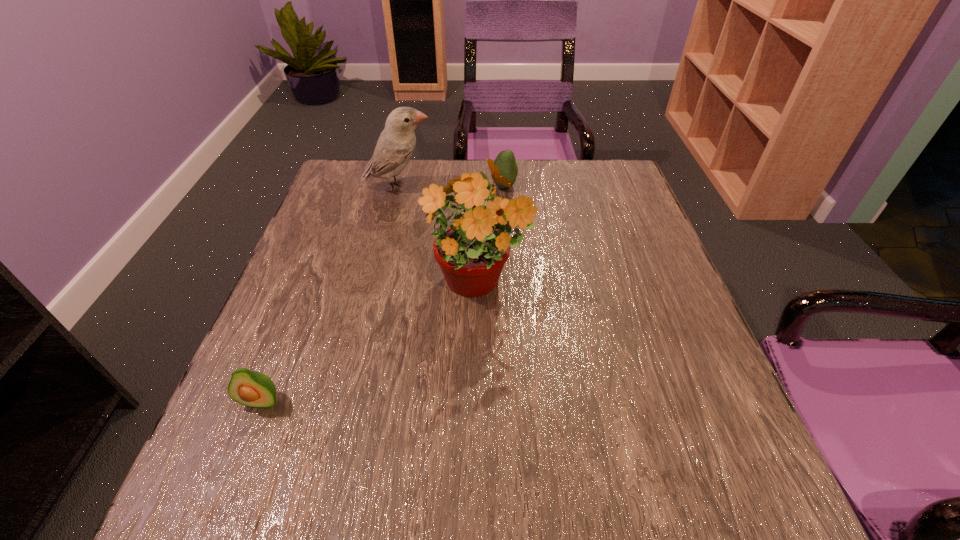
Where is `blank area at the far left corner`? blank area at the far left corner is located at coordinates (345, 164).

The width and height of the screenshot is (960, 540). I want to click on vacant space at the near left corner of the desktop, so click(228, 495).

Where is `vacant space at the far right corner of the desktop`? The width and height of the screenshot is (960, 540). vacant space at the far right corner of the desktop is located at coordinates (591, 204).

The height and width of the screenshot is (540, 960). Find the location of `free space between the farther avocado and the nearer avocado`. free space between the farther avocado and the nearer avocado is located at coordinates (383, 294).

Locate an element on the screen. object that stands as the closest to the third farthest object is located at coordinates (396, 144).

Identify which object is the second nearest to the leftmost object. Please provide its 2D coordinates. Your answer should be formatted as a tuple, i.e. [(x, y)], where the tuple contains the x and y coordinates of a point satisfying the conditions above.

[(396, 144)]

At what (x,y) coordinates should I click in order to perform the action: click on vacant region that satisfies the following two spatial constraints: 1. on the back side of the right avocado; 2. on the right side of the flowerpot. Please return your answer as a coordinate pair (x, y). Looking at the image, I should click on (477, 186).

Identify the location of blank space that satisfies the following two spatial constraints: 1. on the back side of the flowerpot; 2. on the right side of the right avocado. The height and width of the screenshot is (540, 960). (477, 186).

Locate an element on the screen. The width and height of the screenshot is (960, 540). vacant point that satisfies the following two spatial constraints: 1. on the back side of the tallest object; 2. at the face of the second object from left to right is located at coordinates (477, 188).

Where is `vacant space that satisfies the following two spatial constraints: 1. at the face of the bird; 2. on the cut side of the leftmost object`? vacant space that satisfies the following two spatial constraints: 1. at the face of the bird; 2. on the cut side of the leftmost object is located at coordinates (x=347, y=401).